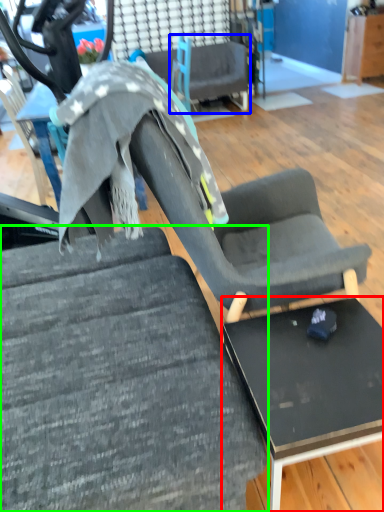
Question: Which object is positioned closest to table (highlighted by a red box)? Select from chair (highlighted by a blue box) and chair (highlighted by a green box).

Choices:
 (A) chair
 (B) chair

Answer: (B)